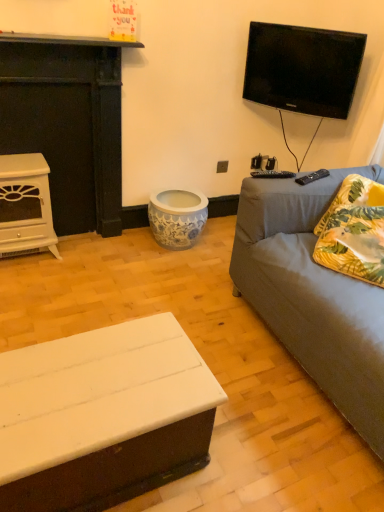
This screenshot has width=384, height=512. Find the location of `free space above white matte fireplace at left, arranged as the 1th fireplace when viewed from the top (from a real-world perspective)`. free space above white matte fireplace at left, arranged as the 1th fireplace when viewed from the top (from a real-world perspective) is located at coordinates (62, 45).